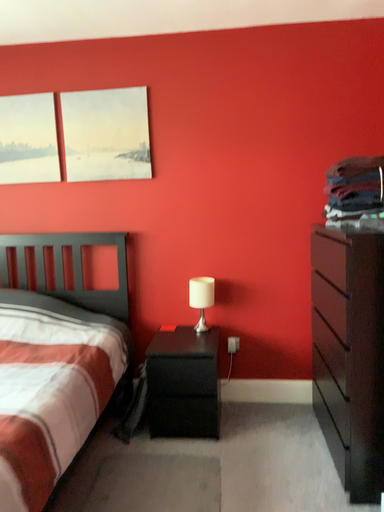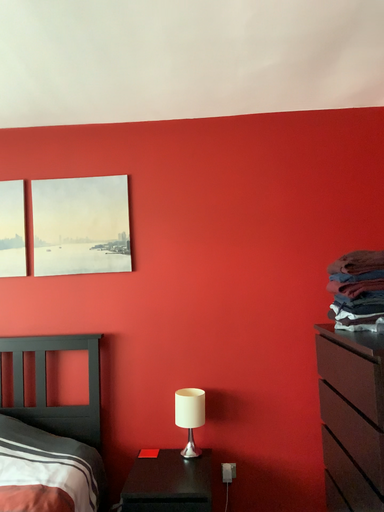
Question: Which way did the camera rotate in the video?

Choices:
 (A) rotated upward
 (B) rotated downward

Answer: (A)